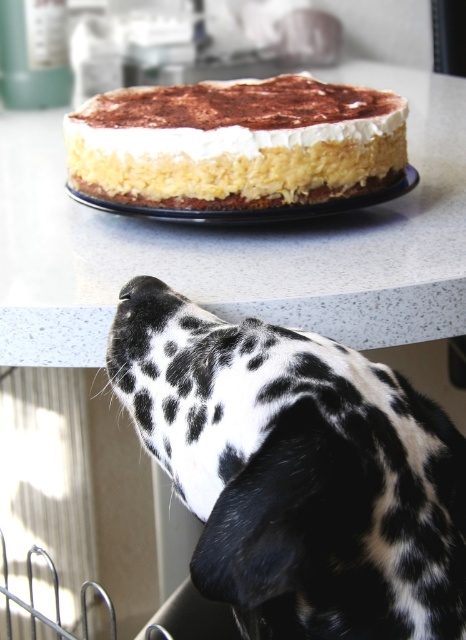
You are a chef who needs to place a 18 inch wide cake on the white speckled table at center. The black and white spotted fur at upper center is currently on the table. Can you fit the cake on the table without moving the fur?

The distance between the black and white spotted fur at upper center and the white speckled table at center is 17.92 inches. Since the cake is 18 inches wide, it is slightly wider than the available space between the fur and the edge of the table. Therefore, the cake cannot be placed without moving the fur.

You are a dog owner trying to decide if your Dalmatian can comfortably lie down on the white speckled table at center. Based on the scene, can the black and white spotted fur at upper center fit on the table?

The black and white spotted fur at upper center is thinner than the white speckled table at center, so the Dalmatian should be able to comfortably lie down on the table.

You are a dog owner who wants to ensure your Dalmatian stays safe while it interacts with the kitchen counter. Based on the scene described, is the black and white spotted fur at upper center located below or above the white speckled table at center?

The black and white spotted fur at upper center is positioned under the white speckled table at center, meaning the Dalmatian is safely below the table surface and not on top of it.